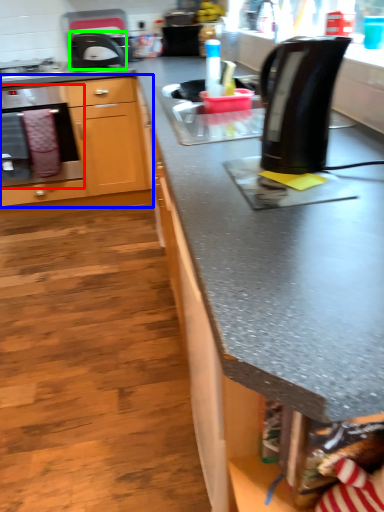
Question: Estimate the real-world distances between objects in this image. Which object is farther from oven (highlighted by a red box), cabinetry (highlighted by a blue box) or kitchen appliance (highlighted by a green box)?

Choices:
 (A) cabinetry
 (B) kitchen appliance

Answer: (B)